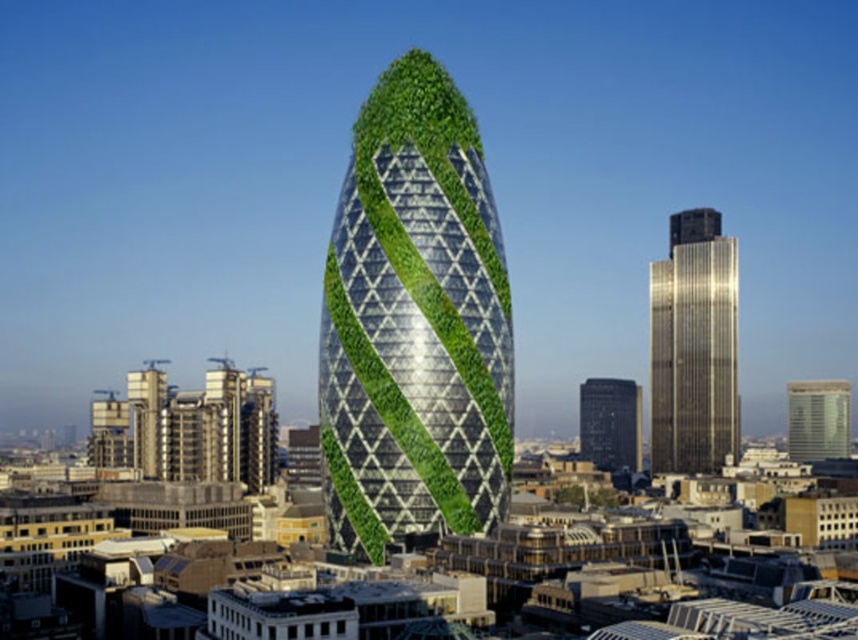
Question: Considering the real-world distances, which object is closest to the matte silver tower at right?

Choices:
 (A) black glass tower at center
 (B) green glass building at center
 (C) gold reflective glass tower at right

Answer: (C)

Question: Can you confirm if gold reflective glass tower at right is wider than matte silver tower at right?

Choices:
 (A) yes
 (B) no

Answer: (B)

Question: Considering the real-world distances, which object is farthest from the matte silver tower at right?

Choices:
 (A) gold reflective glass tower at right
 (B) black glass tower at center

Answer: (B)

Question: Is green glass building at center behind gold reflective glass tower at right?

Choices:
 (A) no
 (B) yes

Answer: (A)

Question: Does green glass building at center appear on the right side of gold reflective glass tower at right?

Choices:
 (A) yes
 (B) no

Answer: (B)

Question: Which of these objects is positioned farthest from the green glass building at center?

Choices:
 (A) matte silver tower at right
 (B) gold reflective glass tower at right
 (C) black glass tower at center

Answer: (A)